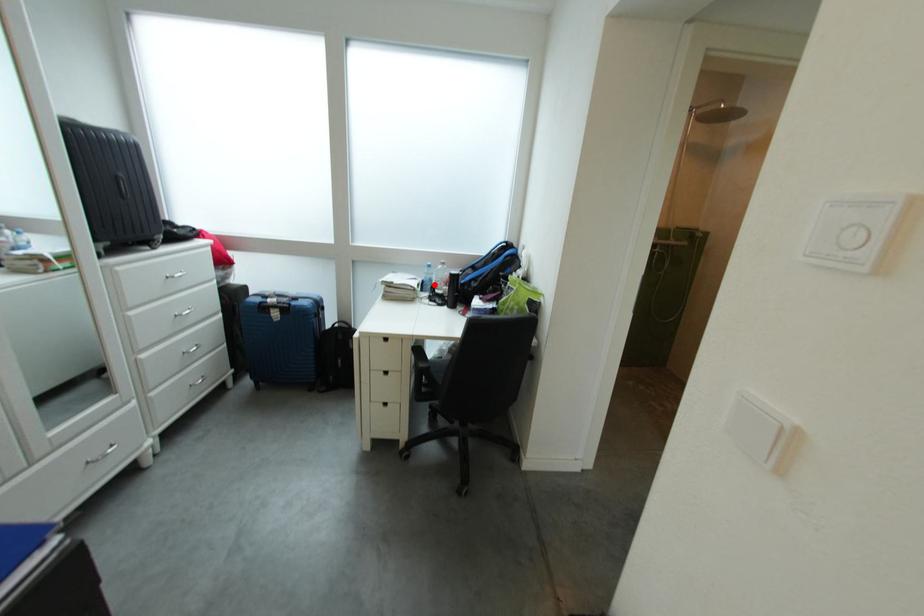
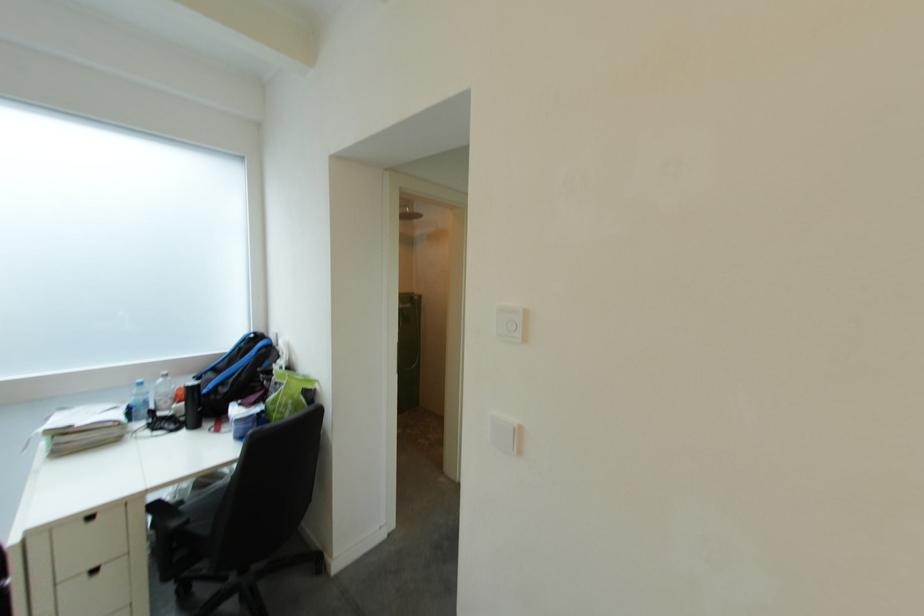
Find the pixel in the second image that matches the highlighted location in the first image.

(141, 411)